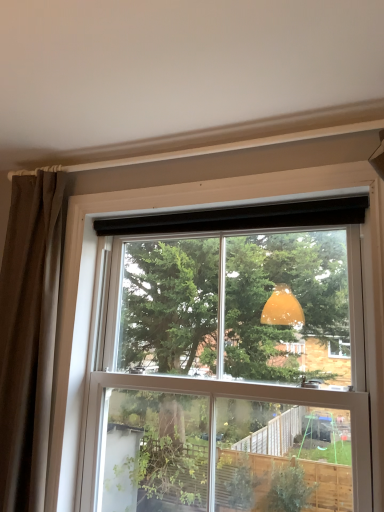
Question: From a real-world perspective, is brown fabric curtain at left physically located above or below transparent glass window at upper center?

Choices:
 (A) below
 (B) above

Answer: (B)

Question: From the image's perspective, is brown fabric curtain at left above or below transparent glass window at upper center?

Choices:
 (A) above
 (B) below

Answer: (A)

Question: In terms of size, does brown fabric curtain at left appear bigger or smaller than transparent glass window at upper center?

Choices:
 (A) big
 (B) small

Answer: (B)

Question: Is transparent glass window at upper center to the left or to the right of brown fabric curtain at left in the image?

Choices:
 (A) left
 (B) right

Answer: (B)

Question: Looking at their shapes, would you say transparent glass window at upper center is wider or thinner than brown fabric curtain at left?

Choices:
 (A) thin
 (B) wide

Answer: (B)

Question: Is transparent glass window at upper center in front of or behind brown fabric curtain at left in the image?

Choices:
 (A) behind
 (B) front

Answer: (B)

Question: Is point (150, 253) positioned closer to the camera than point (28, 414)?

Choices:
 (A) closer
 (B) farther

Answer: (B)